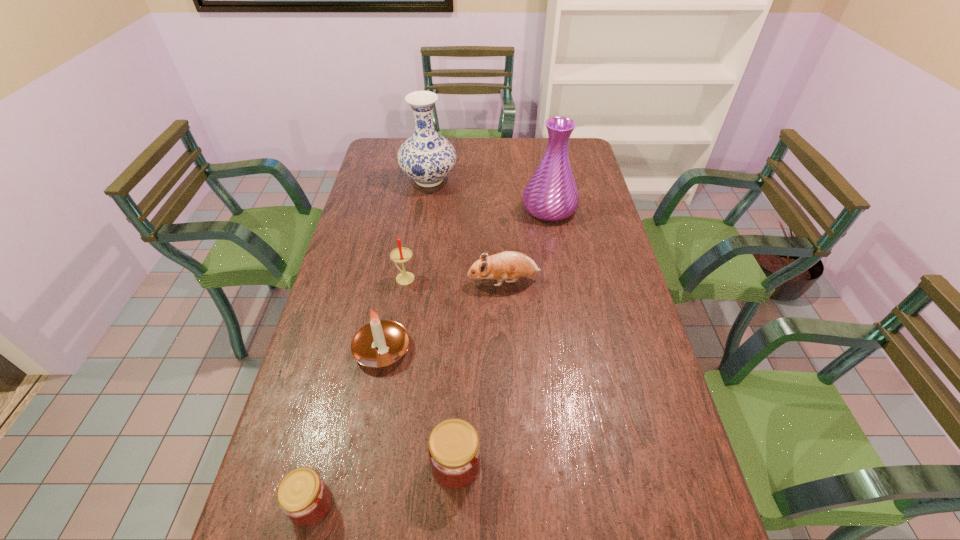
Please show where to add a jam on the right while keeping spacing even. Please provide its 2D coordinates. Your answer should be formatted as a tuple, i.e. [(x, y)], where the tuple contains the x and y coordinates of a point satisfying the conditions above.

[(585, 429)]